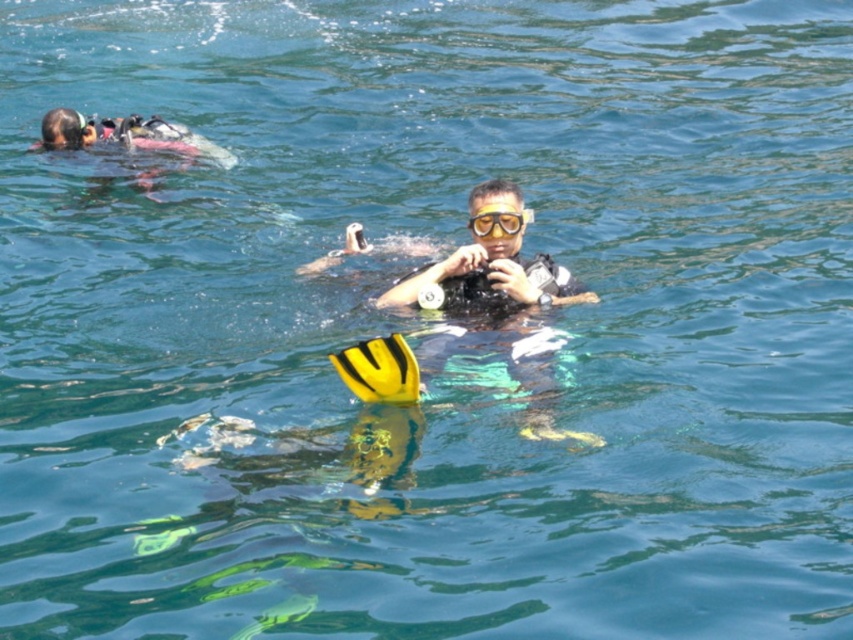
What are the coordinates of the matte black wetsuit at center?

The matte black wetsuit at center is located at coordinates point (488, 266).

You are a photographer positioned at the camera location. You want to capture a closeup shot of the person adjusting their mask in the foreground. The point you need to focus on is labeled as point (461, 284). Given that the focus range of your camera is 8 meters, will you be able to focus on that point?

The point (461, 284) is 10.60 meters away from camera. Since the focus range is only 8 meters, the camera cannot focus on that point.